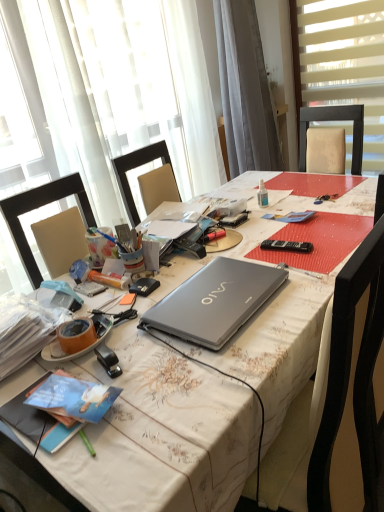
Where is `vacant area located to the right-hand side of black plastic remote control at center`? This screenshot has width=384, height=512. vacant area located to the right-hand side of black plastic remote control at center is located at coordinates [x=235, y=242].